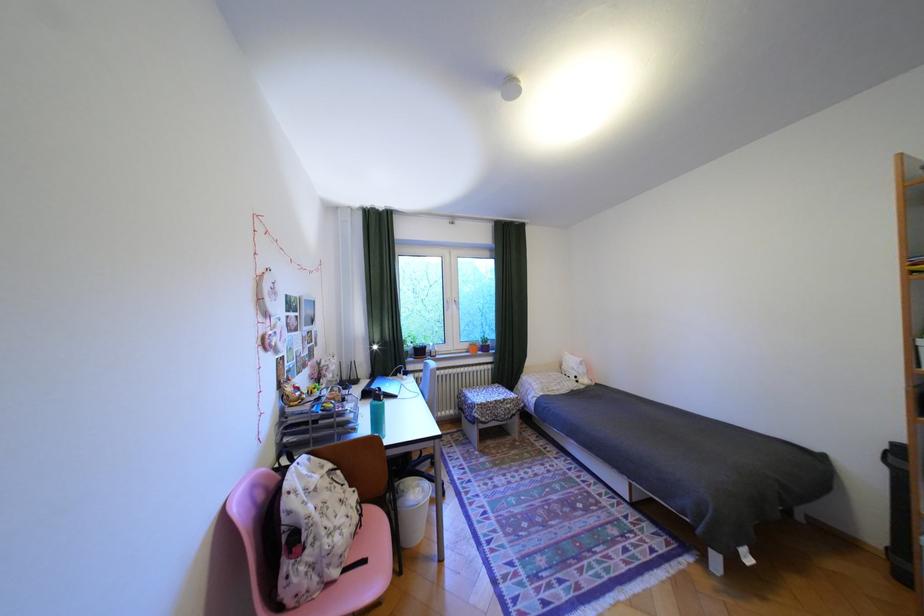
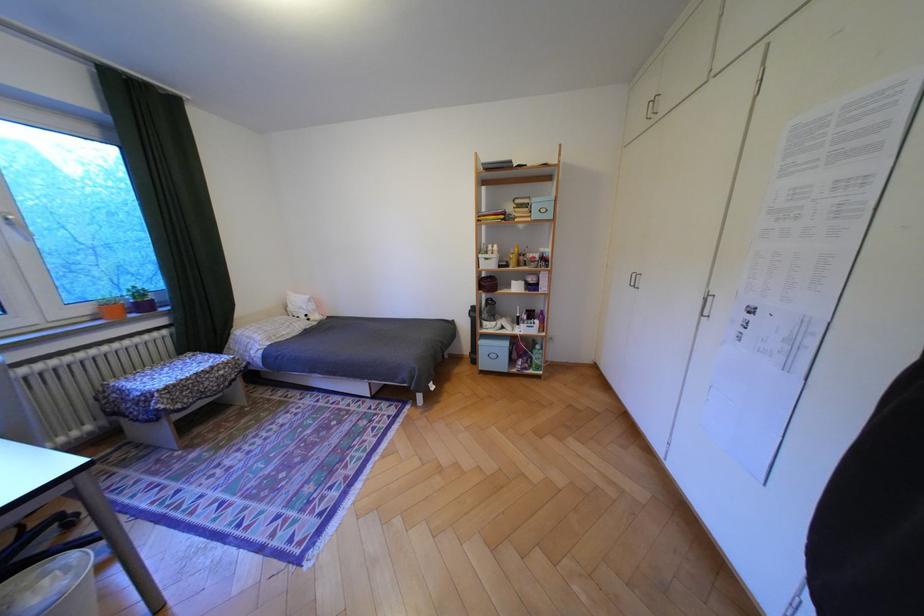
In the second image, find the point that corresponds to (478,346) in the first image.

(99, 310)